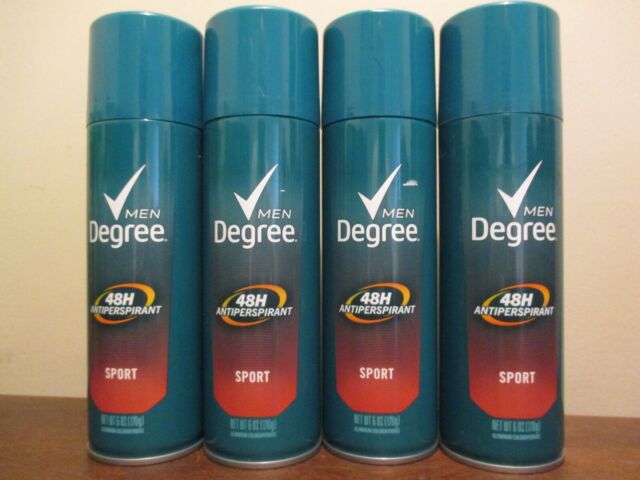
The width and height of the screenshot is (640, 480). I want to click on bottles, so click(x=488, y=267), click(x=394, y=251), click(x=273, y=262), click(x=171, y=258).